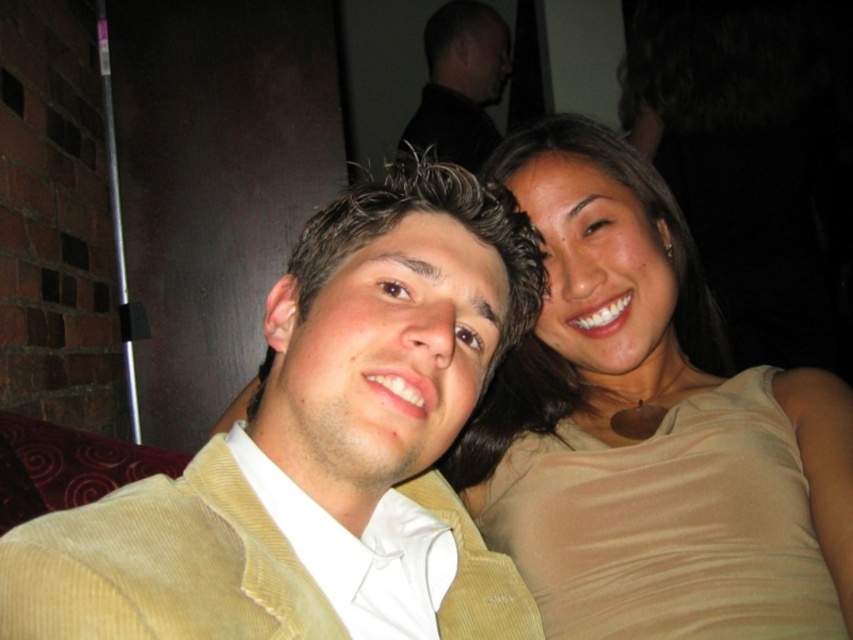
Which is more to the right, yellow corduroy jacket at center or black corduroy jacket at upper center?

black corduroy jacket at upper center is more to the right.

This screenshot has height=640, width=853. What do you see at coordinates (399, 368) in the screenshot?
I see `yellow corduroy jacket at center` at bounding box center [399, 368].

Is point (30, 536) positioned before point (436, 138)?

Yes, it is in front of point (436, 138).

You are a GUI agent. You are given a task and a screenshot of the screen. Output one action in this format:
    pyautogui.click(x=<x>, y=<y>)
    Task: Click on the yellow corduroy jacket at center
    Image resolution: width=853 pixels, height=640 pixels.
    Given the screenshot: What is the action you would take?
    pyautogui.click(x=399, y=368)

Is point (567, 544) farther from camera compared to point (453, 76)?

No, it is in front of (453, 76).

Between matte beige tank top at right and black corduroy jacket at upper center, which one has more height?

black corduroy jacket at upper center

Locate an element on the screen. The width and height of the screenshot is (853, 640). matte beige tank top at right is located at coordinates (651, 429).

Between matte beige tank top at right and yellow corduroy jacket at center, which one is positioned higher?

matte beige tank top at right is above.

Locate an element on the screen. matte beige tank top at right is located at coordinates (651, 429).

Which is behind, point (659, 504) or point (222, 452)?

The point (659, 504) is more distant.

Find the location of a particular element. matte beige tank top at right is located at coordinates (651, 429).